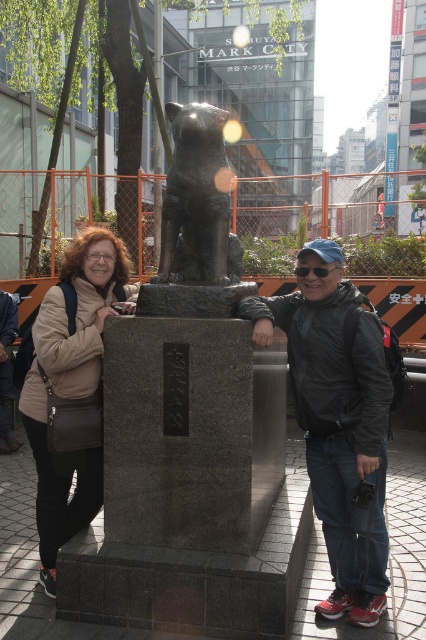
Where is `black matte jacket at right`? black matte jacket at right is located at coordinates (337, 428).

Does matte black statue at center appear under matte brown leather bag at left?

Correct, matte black statue at center is located below matte brown leather bag at left.

Is point (373, 330) positioned after point (60, 461)?

No, (373, 330) is in front of (60, 461).

The width and height of the screenshot is (426, 640). In order to click on matte black statue at center in this screenshot , I will do `click(186, 472)`.

Is point (91, 492) farther from camera compared to point (210, 225)?

That is True.

Who is more distant from viewer, (54, 449) or (144, 289)?

The point (144, 289) is more distant.

Does point (42, 342) lie behind point (253, 284)?

No, (42, 342) is closer to viewer.

The width and height of the screenshot is (426, 640). Find the location of `matte brown leather bag at left`. matte brown leather bag at left is located at coordinates (71, 387).